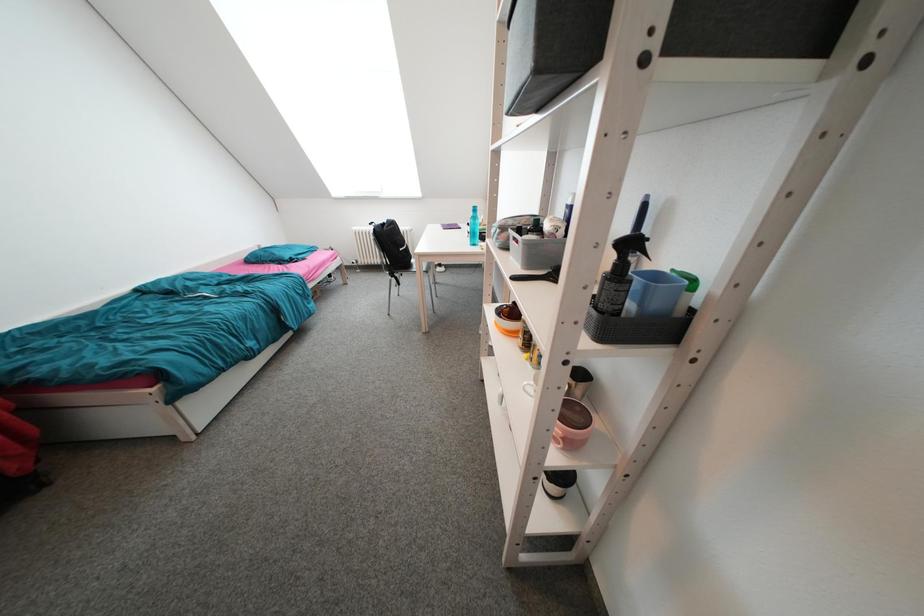
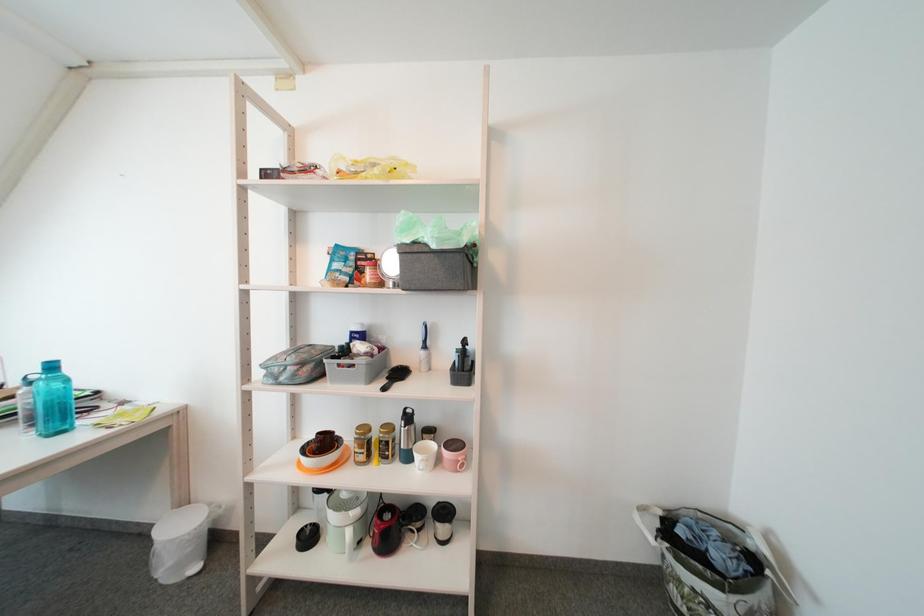
Question: The camera is either moving clockwise (left) or counter-clockwise (right) around the object. The first image is from the beginning of the video and the second image is from the end. Is the camera moving left or right when shooting the video?

Choices:
 (A) Left
 (B) Right

Answer: (A)